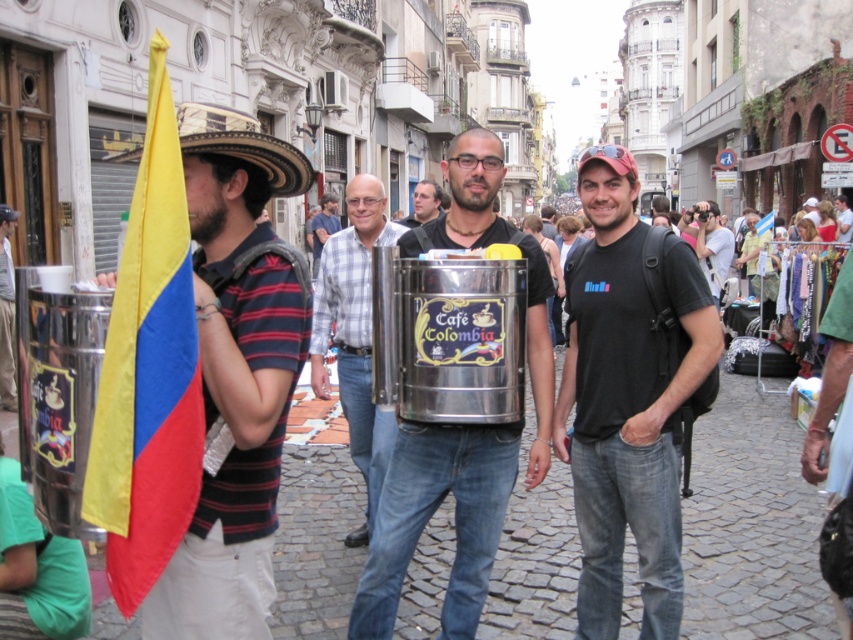
Question: Among these points, which one is farthest from the camera?

Choices:
 (A) (258, 490)
 (B) (125, 316)
 (C) (482, 563)

Answer: (C)

Question: Which of the following is the farthest from the observer?

Choices:
 (A) yellow straw cowboy hat at left
 (B) yellowmaterial/textureflag at left

Answer: (A)

Question: Is yellowmaterial/textureflag at left below metallic silver container at center?

Choices:
 (A) yes
 (B) no

Answer: (B)

Question: Among these points, which one is farthest from the camera?

Choices:
 (A) (845, 211)
 (B) (339, 248)

Answer: (A)

Question: Is brushed metal container at center further to the viewer compared to matte black t-shirt at center?

Choices:
 (A) no
 (B) yes

Answer: (A)

Question: Is matte black flag at left closer to the viewer compared to matte black t-shirt at center?

Choices:
 (A) no
 (B) yes

Answer: (B)